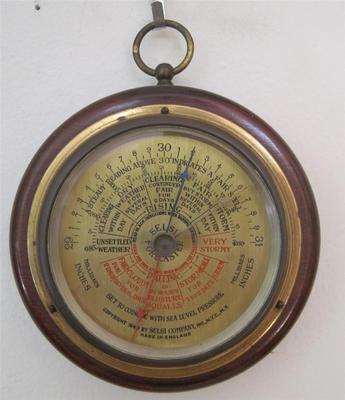
Identify the location of black spot on wall. (36, 9).